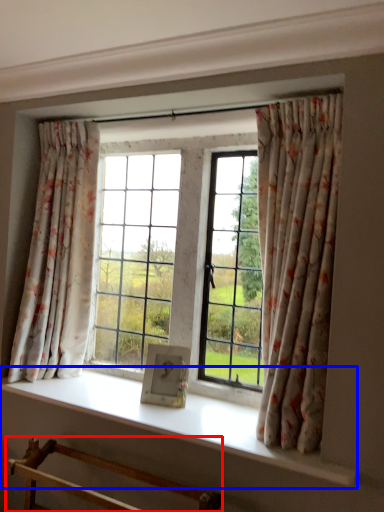
Question: Which object is further to the camera taking this photo, furniture (highlighted by a red box) or window sill (highlighted by a blue box)?

Choices:
 (A) furniture
 (B) window sill

Answer: (B)